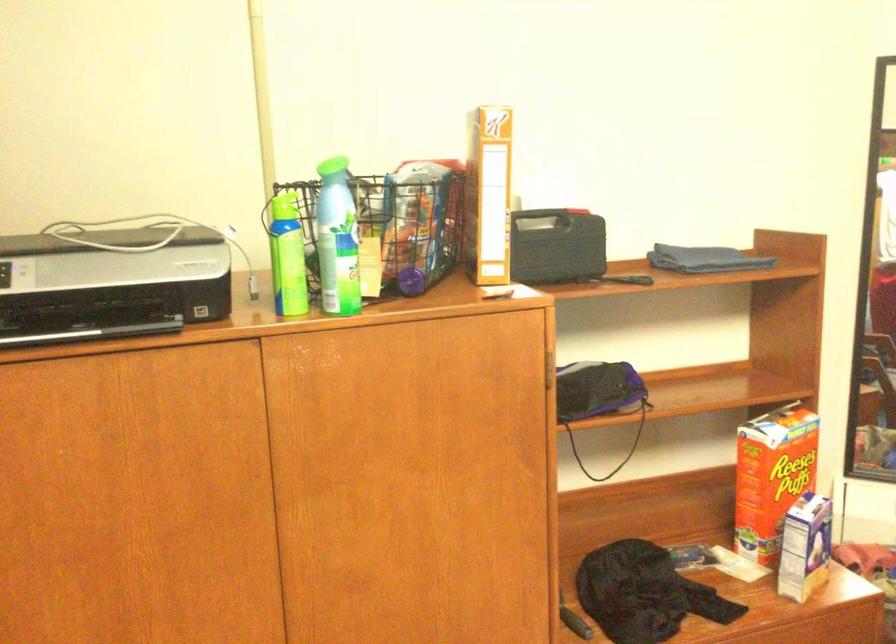
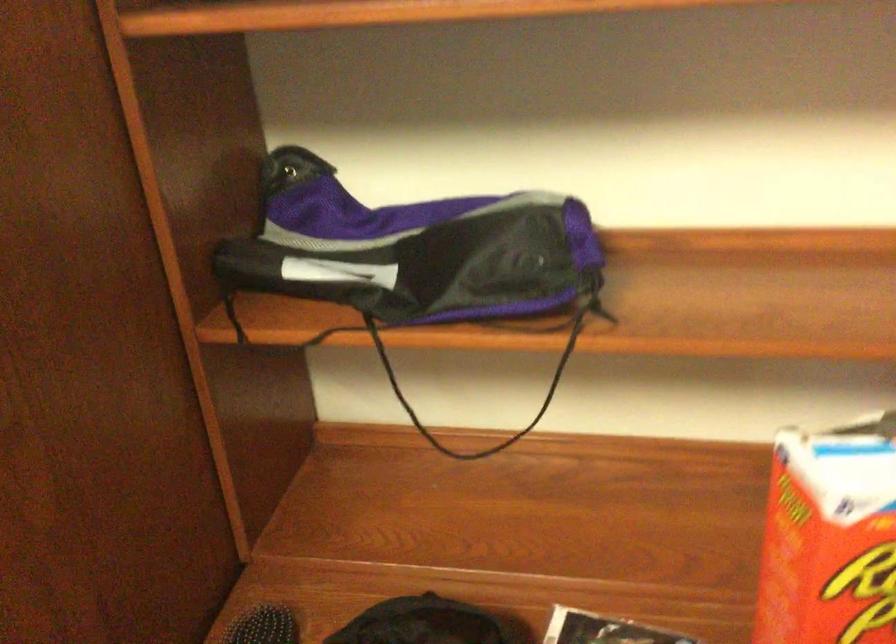
Which direction would the cameraman need to move to produce the second image?

The cameraman walked toward right, forward.